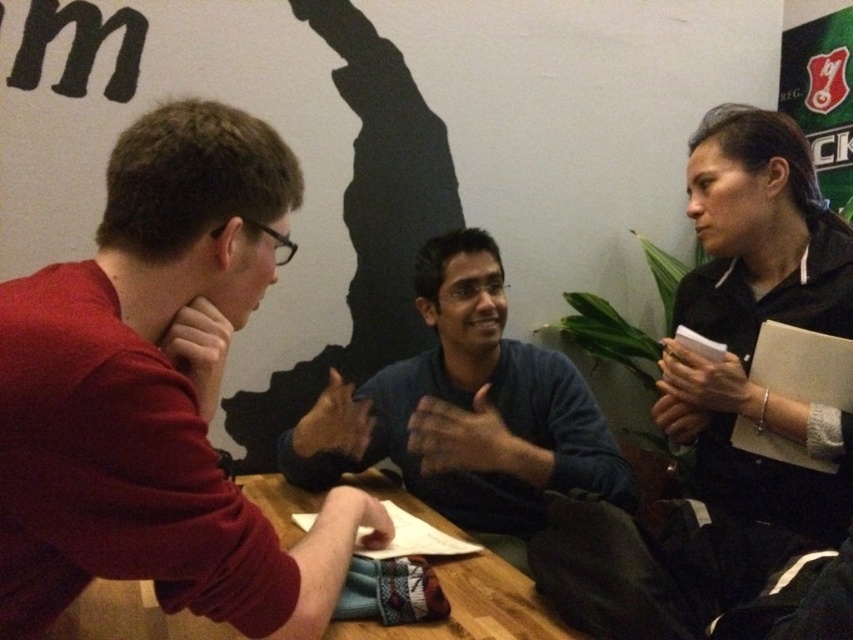
Question: Which of these objects is positioned farthest from the wooden table at center?

Choices:
 (A) black matte jacket at upper right
 (B) dark blue sweater at center

Answer: (A)

Question: Is black matte jacket at upper right thinner than dark blue sweater at center?

Choices:
 (A) yes
 (B) no

Answer: (A)

Question: Which object is positioned farthest from the black matte jacket at upper right?

Choices:
 (A) matte red sweater at left
 (B) wooden table at center
 (C) dark blue sweater at center

Answer: (A)

Question: Can you confirm if dark blue sweater at center is positioned below wooden table at center?

Choices:
 (A) no
 (B) yes

Answer: (A)

Question: Which point is closer to the camera taking this photo?

Choices:
 (A) (410, 502)
 (B) (422, 282)
 (C) (809, 522)

Answer: (C)

Question: Does matte red sweater at left lie behind black matte jacket at upper right?

Choices:
 (A) no
 (B) yes

Answer: (A)